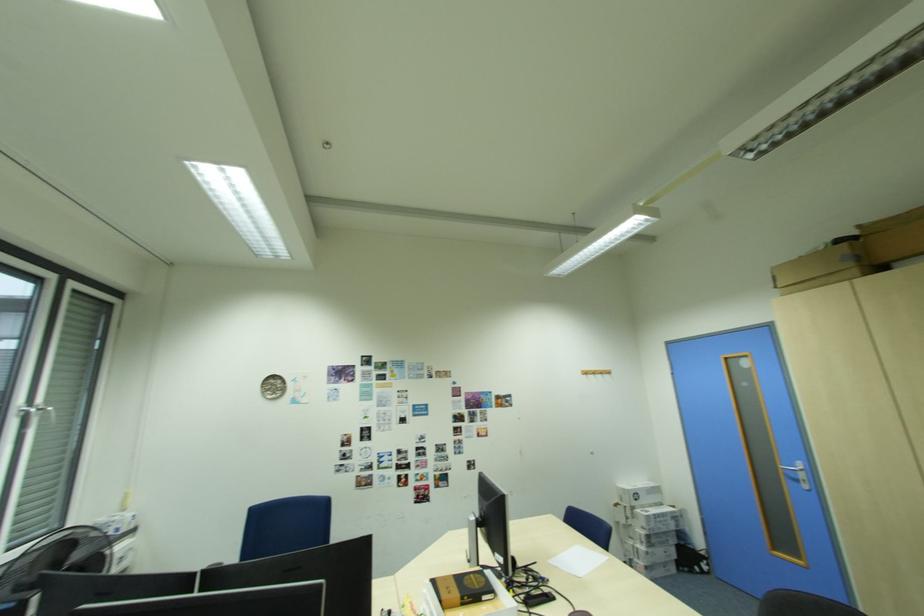
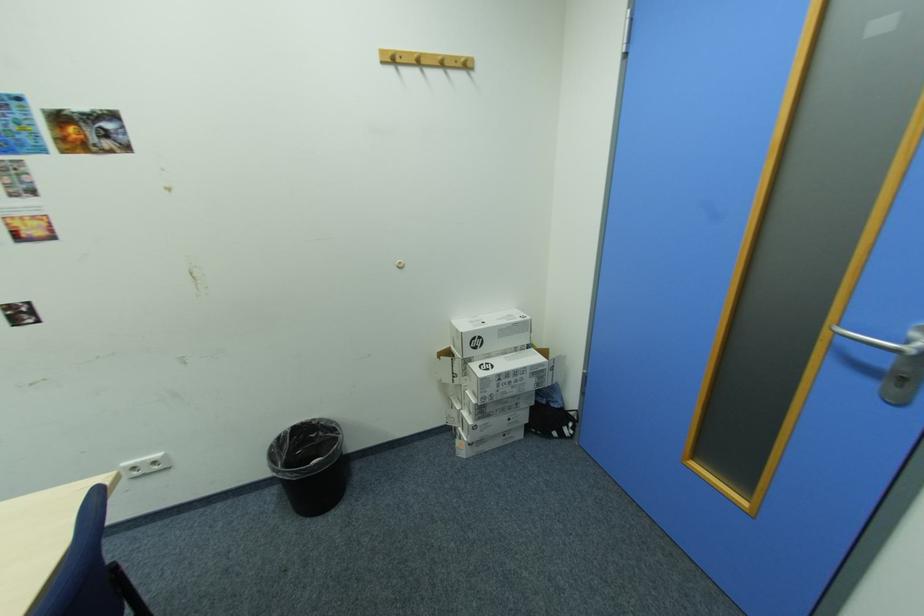
Find the pixel in the second image that matches (630,490) in the first image.

(465, 331)